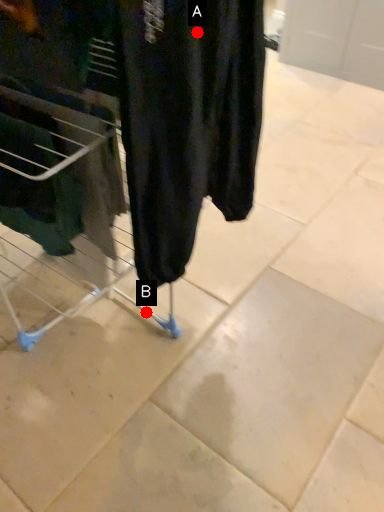
Question: Two points are circled on the image, labeled by A and B beside each circle. Which point is farther from the camera taking this photo?

Choices:
 (A) A is further
 (B) B is further

Answer: (B)